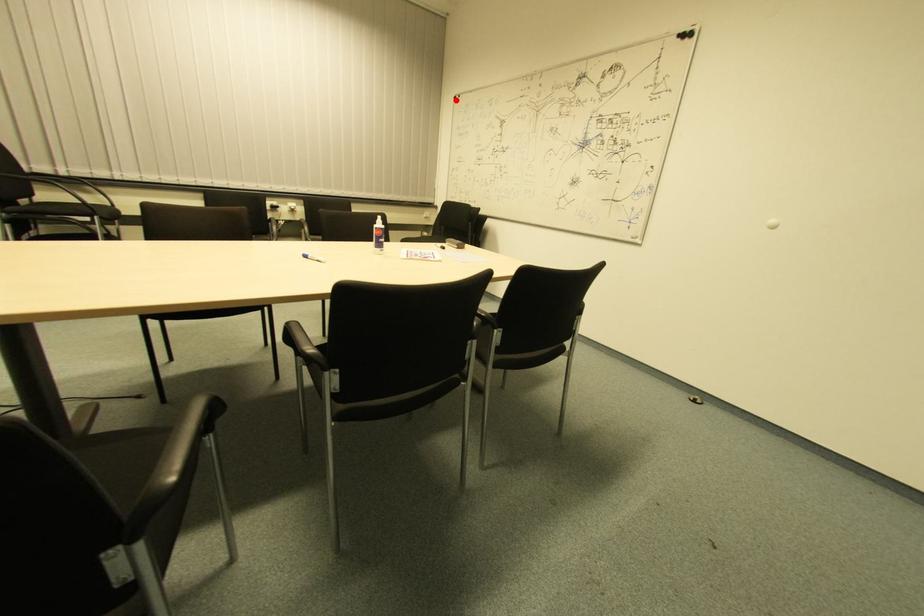
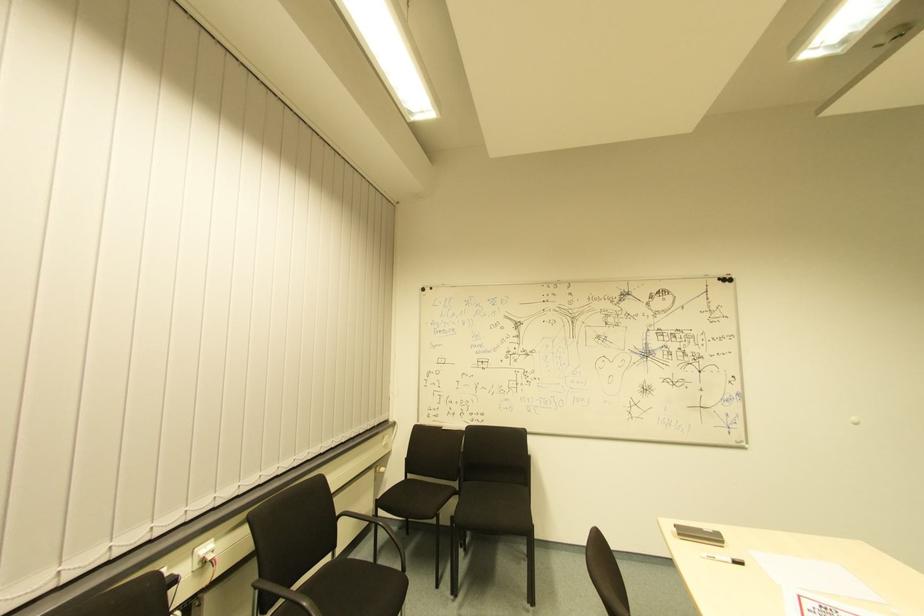
The point at the highlighted location is marked in the first image. Where is the corresponding point in the second image?

(427, 293)